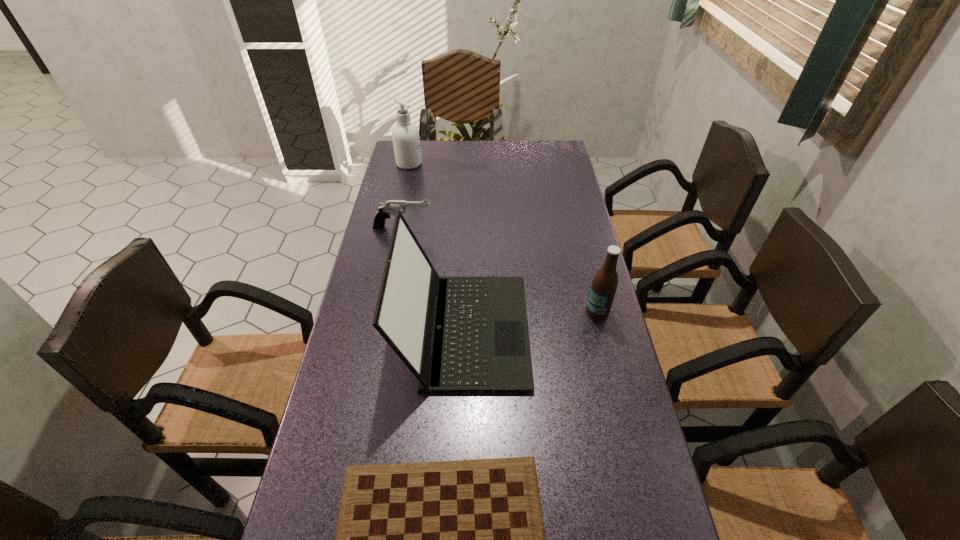
At what (x,y) coordinates should I click in order to perform the action: click on cleansing agent. Please return your answer as a coordinate pair (x, y). The image size is (960, 540). Looking at the image, I should click on (406, 141).

Find the location of a particular element. laptop is located at coordinates (456, 334).

Where is `the rightmost object`? the rightmost object is located at coordinates (604, 285).

Where is `gun`? This screenshot has width=960, height=540. gun is located at coordinates (390, 207).

Image resolution: width=960 pixels, height=540 pixels. Find the location of `the second farthest object`. the second farthest object is located at coordinates (390, 207).

Find the location of a particular element. Image resolution: width=960 pixels, height=540 pixels. vacant space situated 0.340m on the front label of the cleansing agent is located at coordinates (505, 164).

What are the coordinates of `vacant space located on the surface of the laptop` in the screenshot? It's located at (590, 330).

You are a GUI agent. You are given a task and a screenshot of the screen. Output one action in this format:
    pyautogui.click(x=<x>, y=<y>)
    Task: Click on the vacant space situated 0.230m on the left of the rightmost object
    This screenshot has height=540, width=960.
    Given the screenshot: What is the action you would take?
    pyautogui.click(x=505, y=311)

Where is `vacant point located 0.140m at the muzzle of the gun`? The image size is (960, 540). vacant point located 0.140m at the muzzle of the gun is located at coordinates (472, 228).

At what (x,y) coordinates should I click in order to perform the action: click on object at the far edge. Please return your answer as a coordinate pair (x, y). Looking at the image, I should click on (406, 141).